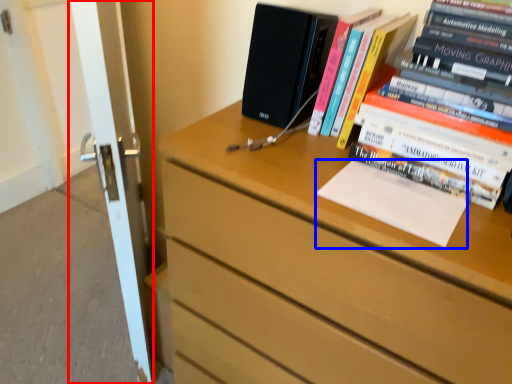
Question: Which point is further to the camera, screen door (highlighted by a red box) or paperback book (highlighted by a blue box)?

Choices:
 (A) screen door
 (B) paperback book

Answer: (A)